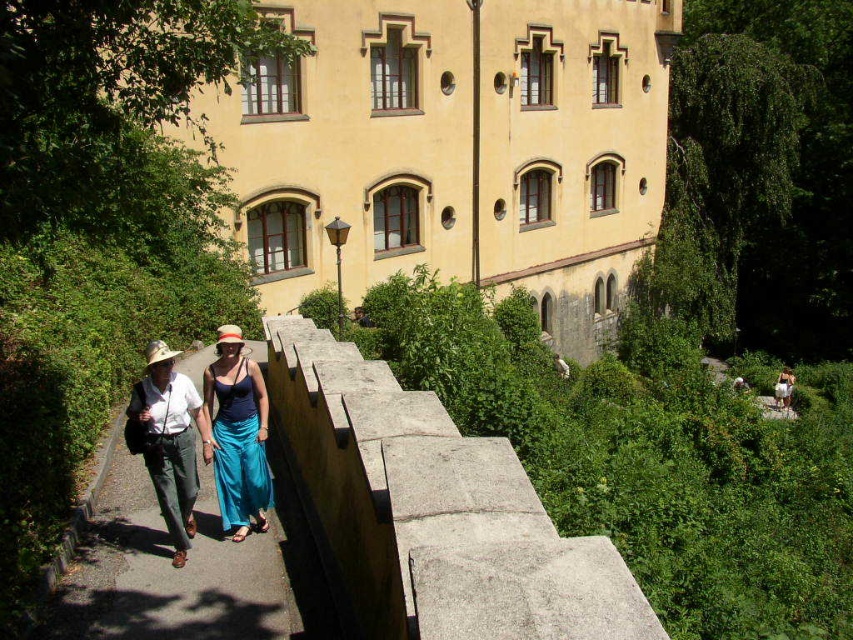
Question: Which point is closer to the camera?

Choices:
 (A) (596, 211)
 (B) (263, 502)
 (C) (280, 538)
 (D) (169, 483)

Answer: (D)

Question: Does yellow stucco building at upper center appear on the right side of blue silk dress at center?

Choices:
 (A) yes
 (B) no

Answer: (A)

Question: Which point is farther to the camera?

Choices:
 (A) (51, 637)
 (B) (178, 502)

Answer: (B)

Question: Is yellow stucco building at upper center smaller than teal satin dress at center?

Choices:
 (A) no
 (B) yes

Answer: (A)

Question: Does concrete paved path at center appear on the right side of blue silk dress at center?

Choices:
 (A) yes
 (B) no

Answer: (B)

Question: Which object is farther from the camera taking this photo?

Choices:
 (A) teal satin dress at center
 (B) blue silk dress at center
 (C) concrete paved path at center
 (D) yellow stucco building at upper center

Answer: (D)